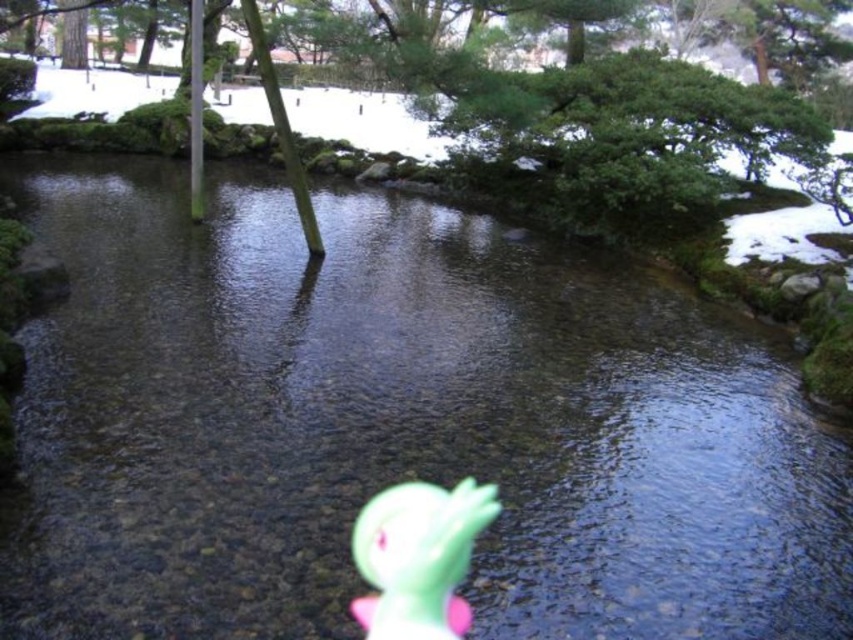
Question: Which object is closer to the camera taking this photo?

Choices:
 (A) green leafy tree at center
 (B) green rubber duck at lower center

Answer: (B)

Question: Does green rubber duck at lower center appear on the left side of green leafy tree at center?

Choices:
 (A) no
 (B) yes

Answer: (A)

Question: Is green rubber duck at lower center above green leafy tree at center?

Choices:
 (A) yes
 (B) no

Answer: (B)

Question: Observing the image, what is the correct spatial positioning of green rubber duck at lower center in reference to green leafy tree at center?

Choices:
 (A) above
 (B) below

Answer: (B)

Question: Which object appears farthest from the camera in this image?

Choices:
 (A) green leafy tree at center
 (B) green rubber duck at lower center

Answer: (A)